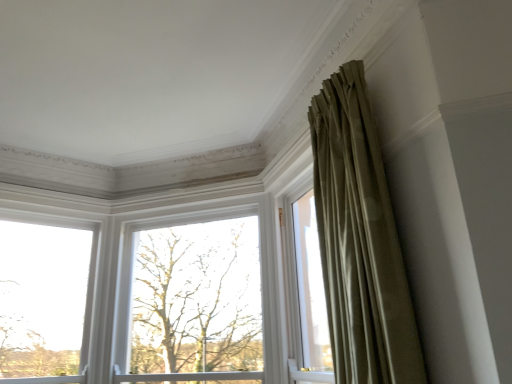
How much space does white matte window at center, placed as the 1th window when sorted from right to left, occupy vertically?

white matte window at center, placed as the 1th window when sorted from right to left, is 1.48 meters in height.

I want to click on bare branches at center, so [197, 299].

What is the approximate width of silky olive drab curtain at upper right?

The width of silky olive drab curtain at upper right is 11.18 inches.

The height and width of the screenshot is (384, 512). I want to click on silky olive drab curtain at upper right, so click(360, 241).

Identify the location of white matte window at center, which is the second window in left-to-right order. The height and width of the screenshot is (384, 512). click(x=131, y=274).

Which object is positioned more to the left, bare branches at center or clear glass window at left, the 2th window when ordered from right to left?

clear glass window at left, the 2th window when ordered from right to left.

Does bare branches at center have a larger size compared to clear glass window at left, the 2th window when ordered from right to left?

Yes.

How different are the orientations of bare branches at center and clear glass window at left, the 2th window when ordered from right to left, in degrees?

bare branches at center and clear glass window at left, the 2th window when ordered from right to left, are facing 55.8 degrees away from each other.

Can you confirm if bare branches at center is thinner than clear glass window at left, which is the 1th window from left to right?

No, bare branches at center is not thinner than clear glass window at left, which is the 1th window from left to right.

Is bare branches at center oriented towards white matte window at center, which is the second window in left-to-right order?

Yes, bare branches at center is aimed at white matte window at center, which is the second window in left-to-right order.

Who is bigger, bare branches at center or white matte window at center, placed as the 1th window when sorted from right to left?

Bigger between the two is white matte window at center, placed as the 1th window when sorted from right to left.

Is bare branches at center beside white matte window at center, which is the second window in left-to-right order?

No, bare branches at center is not next to white matte window at center, which is the second window in left-to-right order.

From a real-world perspective, which object stands above the other?

In real-world perspective, white matte window at center, placed as the 1th window when sorted from right to left, is above.

Based on the photo, is clear glass window at left, the 2th window when ordered from right to left, oriented towards bare branches at center?

No.

Considering the relative sizes of clear glass window at left, which is the 1th window from left to right, and bare branches at center in the image provided, is clear glass window at left, which is the 1th window from left to right, shorter than bare branches at center?

Indeed, clear glass window at left, which is the 1th window from left to right, has a lesser height compared to bare branches at center.

Is the position of clear glass window at left, the 2th window when ordered from right to left, more distant than that of bare branches at center?

No, the depth of clear glass window at left, the 2th window when ordered from right to left, is less than that of bare branches at center.

Looking at this image, how different are the orientations of clear glass window at left, which is the 1th window from left to right, and bare branches at center in degrees?

clear glass window at left, which is the 1th window from left to right, and bare branches at center are facing 55.8 degrees away from each other.

Is the position of silky olive drab curtain at upper right more distant than that of white matte window at center, placed as the 1th window when sorted from right to left?

No, it is in front of white matte window at center, placed as the 1th window when sorted from right to left.

From the silky olive drab curtain at upper right, count 2nd windows backward and point to it. Please provide its 2D coordinates.

[(131, 274)]

Who is bigger, silky olive drab curtain at upper right or white matte window at center, which is the second window in left-to-right order?

white matte window at center, which is the second window in left-to-right order.

Between silky olive drab curtain at upper right and white matte window at center, which is the second window in left-to-right order, which one has more height?

white matte window at center, which is the second window in left-to-right order.

Is white matte window at center, placed as the 1th window when sorted from right to left, oriented away from clear glass window at left, the 2th window when ordered from right to left?

No, white matte window at center, placed as the 1th window when sorted from right to left, is not facing the opposite direction of clear glass window at left, the 2th window when ordered from right to left.

Based on their sizes in the image, would you say white matte window at center, placed as the 1th window when sorted from right to left, is bigger or smaller than clear glass window at left, the 2th window when ordered from right to left?

Considering their sizes, white matte window at center, placed as the 1th window when sorted from right to left, takes up more space than clear glass window at left, the 2th window when ordered from right to left.

From a real-world perspective, between white matte window at center, which is the second window in left-to-right order, and clear glass window at left, the 2th window when ordered from right to left, who is vertically lower?

clear glass window at left, the 2th window when ordered from right to left, is physically lower.

Considering the relative positions of white matte window at center, which is the second window in left-to-right order, and clear glass window at left, which is the 1th window from left to right, in the image provided, is white matte window at center, which is the second window in left-to-right order, to the left or to the right of clear glass window at left, which is the 1th window from left to right,?

white matte window at center, which is the second window in left-to-right order, is to the right of clear glass window at left, which is the 1th window from left to right.

Is clear glass window at left, the 2th window when ordered from right to left, completely or partially inside silky olive drab curtain at upper right?

No, clear glass window at left, the 2th window when ordered from right to left, is not surrounded by silky olive drab curtain at upper right.

Considering the sizes of objects silky olive drab curtain at upper right and clear glass window at left, the 2th window when ordered from right to left, in the image provided, who is shorter, silky olive drab curtain at upper right or clear glass window at left, the 2th window when ordered from right to left,?

With less height is clear glass window at left, the 2th window when ordered from right to left.

From the image's perspective, is silky olive drab curtain at upper right beneath clear glass window at left, which is the 1th window from left to right?

Actually, silky olive drab curtain at upper right appears above clear glass window at left, which is the 1th window from left to right, in the image.

Which object is positioned more to the right, clear glass window at left, the 2th window when ordered from right to left, or white matte window at center, placed as the 1th window when sorted from right to left?

From the viewer's perspective, white matte window at center, placed as the 1th window when sorted from right to left, appears more on the right side.

Does clear glass window at left, the 2th window when ordered from right to left, have a lesser width compared to white matte window at center, which is the second window in left-to-right order?

Incorrect, the width of clear glass window at left, the 2th window when ordered from right to left, is not less than that of white matte window at center, which is the second window in left-to-right order.

There is a clear glass window at left, which is the 1th window from left to right. Identify the location of window above it (from a real-world perspective). The width and height of the screenshot is (512, 384). (131, 274).

Is clear glass window at left, which is the 1th window from left to right, directly adjacent to white matte window at center, placed as the 1th window when sorted from right to left?

They are not placed beside each other.

This screenshot has width=512, height=384. I want to click on tree that appears behind the clear glass window at left, which is the 1th window from left to right, so click(x=197, y=299).

At what (x,y) coordinates should I click in order to perform the action: click on window above the bare branches at center (from the image's perspective). Please return your answer as a coordinate pair (x, y). Looking at the image, I should click on (131, 274).

From the image, which object appears to be nearer to bare branches at center, white matte window at center, which is the second window in left-to-right order, or silky olive drab curtain at upper right?

white matte window at center, which is the second window in left-to-right order, lies closer to bare branches at center than the other object.

Looking at the image, which one is located further to bare branches at center, clear glass window at left, which is the 1th window from left to right, or white matte window at center, placed as the 1th window when sorted from right to left?

clear glass window at left, which is the 1th window from left to right, lies further to bare branches at center than the other object.

Based on their spatial positions, is bare branches at center or white matte window at center, which is the second window in left-to-right order, further from silky olive drab curtain at upper right?

bare branches at center.

Estimate the real-world distances between objects in this image. Which object is further from bare branches at center, white matte window at center, which is the second window in left-to-right order, or clear glass window at left, which is the 1th window from left to right?

clear glass window at left, which is the 1th window from left to right, lies further to bare branches at center than the other object.

Looking at the image, which one is located further to white matte window at center, which is the second window in left-to-right order, silky olive drab curtain at upper right or bare branches at center?

silky olive drab curtain at upper right is positioned further to the anchor white matte window at center, which is the second window in left-to-right order.

When comparing their distances from white matte window at center, placed as the 1th window when sorted from right to left, does bare branches at center or clear glass window at left, which is the 1th window from left to right, seem closer?

bare branches at center lies closer to white matte window at center, placed as the 1th window when sorted from right to left, than the other object.

Considering their positions, is silky olive drab curtain at upper right positioned further to clear glass window at left, the 2th window when ordered from right to left, than bare branches at center?

silky olive drab curtain at upper right is positioned further to the anchor clear glass window at left, the 2th window when ordered from right to left.

Considering their positions, is white matte window at center, which is the second window in left-to-right order, positioned further to silky olive drab curtain at upper right than clear glass window at left, the 2th window when ordered from right to left?

clear glass window at left, the 2th window when ordered from right to left, is positioned further to the anchor silky olive drab curtain at upper right.

Where is `window between clear glass window at left, the 2th window when ordered from right to left, and bare branches at center, in the horizontal direction`? This screenshot has height=384, width=512. window between clear glass window at left, the 2th window when ordered from right to left, and bare branches at center, in the horizontal direction is located at coordinates (131, 274).

Locate an element on the screen. This screenshot has width=512, height=384. tree situated between clear glass window at left, which is the 1th window from left to right, and silky olive drab curtain at upper right from left to right is located at coordinates (197, 299).

Locate an element on the screen. window situated between clear glass window at left, which is the 1th window from left to right, and silky olive drab curtain at upper right from left to right is located at coordinates (131, 274).